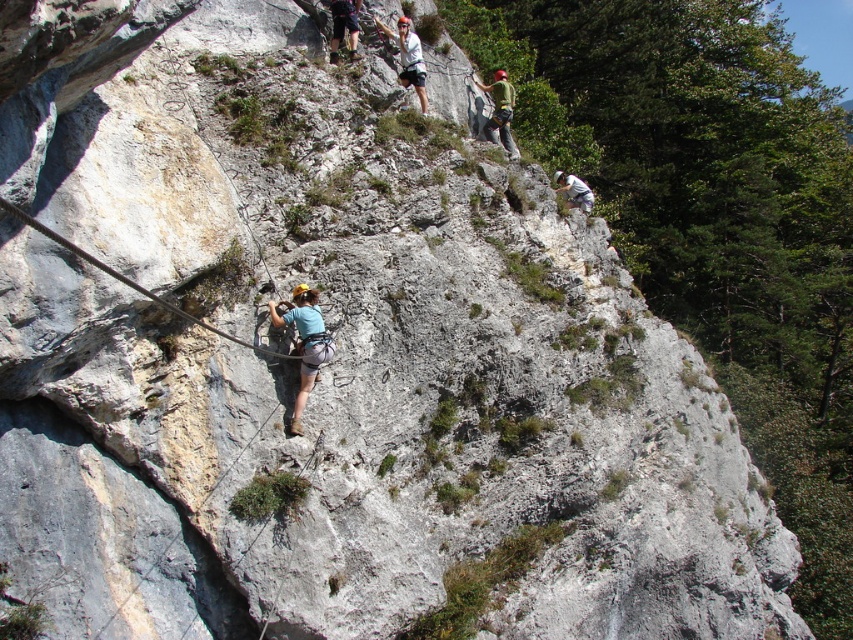
Question: Estimate the real-world distances between objects in this image. Which object is closer to the white matte helmet at center?

Choices:
 (A) black wire rope at center
 (B) green fabric climbing harness at upper center
 (C) matte gray climbing harness at center

Answer: (B)

Question: Which is nearer to the black wire rope at center?

Choices:
 (A) matte gray shorts at center
 (B) green fabric climbing harness at upper center
 (C) white matte helmet at center
 (D) matte gray climbing harness at center

Answer: (D)

Question: Is the position of white matte helmet at center more distant than that of matte gray shorts at center?

Choices:
 (A) yes
 (B) no

Answer: (A)

Question: Does matte gray climbing harness at center have a greater width compared to white fabric at upper center?

Choices:
 (A) yes
 (B) no

Answer: (A)

Question: Which point is farther to the camera?

Choices:
 (A) (350, 35)
 (B) (498, 106)
 (C) (316, 374)

Answer: (B)

Question: Does white matte helmet at center appear on the right side of white fabric at upper center?

Choices:
 (A) yes
 (B) no

Answer: (B)